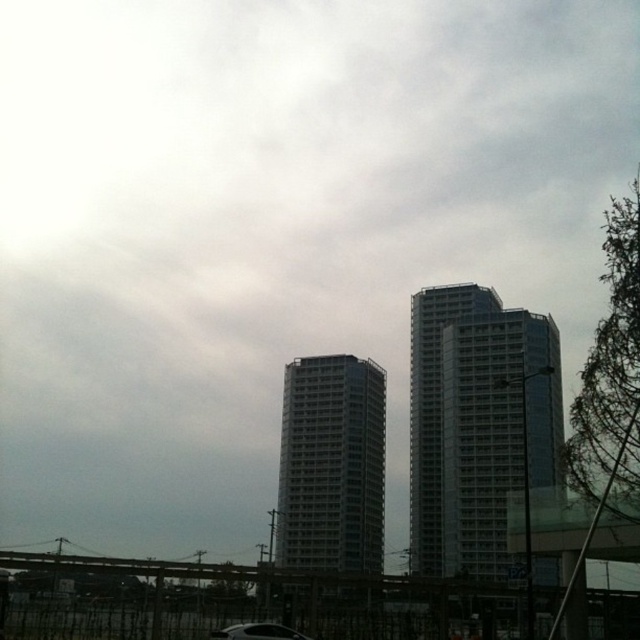
You are a delivery driver who needs to park your black glossy car at lower center near the gray concrete building at center. Given that the parking space available is 20 feet long, can you safely park your car within the designated area?

The distance between the gray concrete building at center and the black glossy car at lower center is 324.82 feet. Since the parking space is only 20 feet long, the car cannot be parked within the designated area as it is much farther away than the available space.

You are standing at the center of the image and want to walk towards the glassy silver building at right. Which direction should you face to move directly towards it?

Since the glassy silver building at right is located at point 0.666 on the x axis, which is to the right of the center point at 0.5, you should face to the right to move directly towards it.